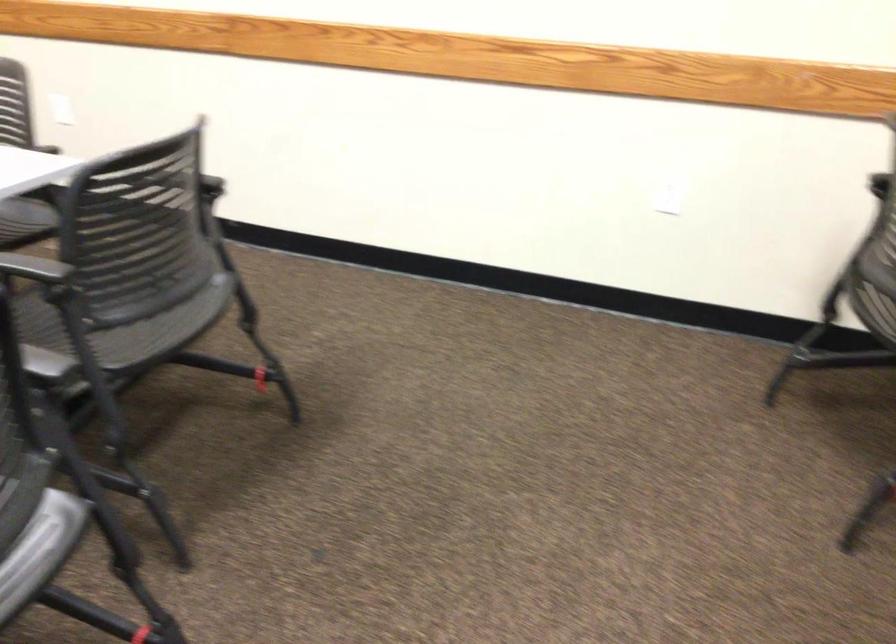
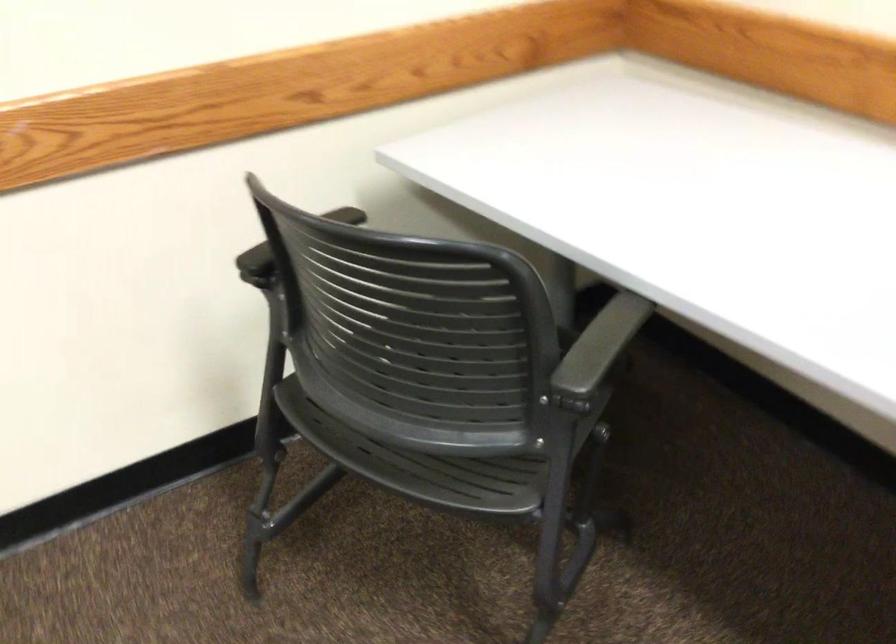
Question: Based on the continuous images, in which direction is the camera rotating? Reply with the corresponding letter.

Choices:
 (A) Left
 (B) Right
 (C) Up
 (D) Down

Answer: (B)